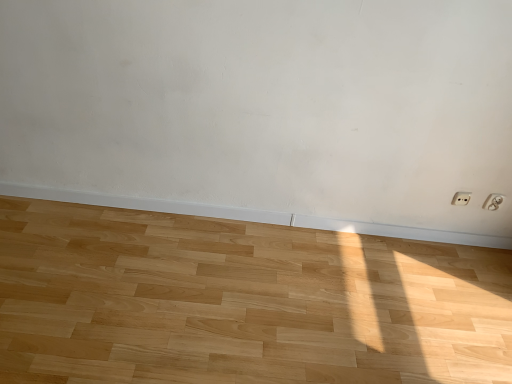
Question: Can you confirm if white plastic electric outlet at lower right, the 2th electric outlet when ordered from left to right, is bigger than white plastic electric outlet at lower right, the second electric outlet viewed from the right?

Choices:
 (A) yes
 (B) no

Answer: (A)

Question: Is white plastic electric outlet at lower right, the 2th electric outlet when ordered from left to right, aimed at white plastic electric outlet at lower right, which is the first electric outlet from left to right?

Choices:
 (A) no
 (B) yes

Answer: (A)

Question: Can you confirm if white plastic electric outlet at lower right, which is counted as the 1th electric outlet, starting from the right, is positioned to the left of white plastic electric outlet at lower right, which is the first electric outlet from left to right?

Choices:
 (A) yes
 (B) no

Answer: (B)

Question: Is white plastic electric outlet at lower right, the 2th electric outlet when ordered from left to right, outside of white plastic electric outlet at lower right, which is the first electric outlet from left to right?

Choices:
 (A) no
 (B) yes

Answer: (B)

Question: Considering the relative sizes of white plastic electric outlet at lower right, which is counted as the 1th electric outlet, starting from the right, and white plastic electric outlet at lower right, which is the first electric outlet from left to right, in the image provided, is white plastic electric outlet at lower right, which is counted as the 1th electric outlet, starting from the right, smaller than white plastic electric outlet at lower right, which is the first electric outlet from left to right,?

Choices:
 (A) yes
 (B) no

Answer: (B)

Question: Looking at their shapes, would you say white plastic electric outlet at lower right, the second electric outlet viewed from the right, is wider or thinner than white plastic electric outlet at lower right, the 2th electric outlet when ordered from left to right?

Choices:
 (A) thin
 (B) wide

Answer: (A)

Question: From a real-world perspective, is white plastic electric outlet at lower right, the second electric outlet viewed from the right, above or below white plastic electric outlet at lower right, which is counted as the 1th electric outlet, starting from the right?

Choices:
 (A) below
 (B) above

Answer: (A)

Question: In terms of size, does white plastic electric outlet at lower right, the second electric outlet viewed from the right, appear bigger or smaller than white plastic electric outlet at lower right, which is counted as the 1th electric outlet, starting from the right?

Choices:
 (A) small
 (B) big

Answer: (A)

Question: Considering the positions of white plastic electric outlet at lower right, which is the first electric outlet from left to right, and white plastic electric outlet at lower right, which is counted as the 1th electric outlet, starting from the right, in the image, is white plastic electric outlet at lower right, which is the first electric outlet from left to right, taller or shorter than white plastic electric outlet at lower right, which is counted as the 1th electric outlet, starting from the right,?

Choices:
 (A) tall
 (B) short

Answer: (B)

Question: From a real-world perspective, is white plastic electric outlet at lower right, which is counted as the 1th electric outlet, starting from the right, above or below natural wood floor at center?

Choices:
 (A) above
 (B) below

Answer: (A)

Question: From their relative heights in the image, would you say white plastic electric outlet at lower right, which is counted as the 1th electric outlet, starting from the right, is taller or shorter than natural wood floor at center?

Choices:
 (A) short
 (B) tall

Answer: (B)

Question: Is white plastic electric outlet at lower right, which is counted as the 1th electric outlet, starting from the right, inside the boundaries of natural wood floor at center, or outside?

Choices:
 (A) inside
 (B) outside

Answer: (B)

Question: Is point (495, 193) positioned closer to the camera than point (280, 258)?

Choices:
 (A) closer
 (B) farther

Answer: (A)

Question: Visually, is white plastic electric outlet at lower right, the 2th electric outlet when ordered from left to right, positioned to the left or to the right of white plastic electric outlet at lower right, which is the first electric outlet from left to right?

Choices:
 (A) right
 (B) left

Answer: (A)

Question: From the image's perspective, is white plastic electric outlet at lower right, the 2th electric outlet when ordered from left to right, located above or below white plastic electric outlet at lower right, which is the first electric outlet from left to right?

Choices:
 (A) above
 (B) below

Answer: (B)